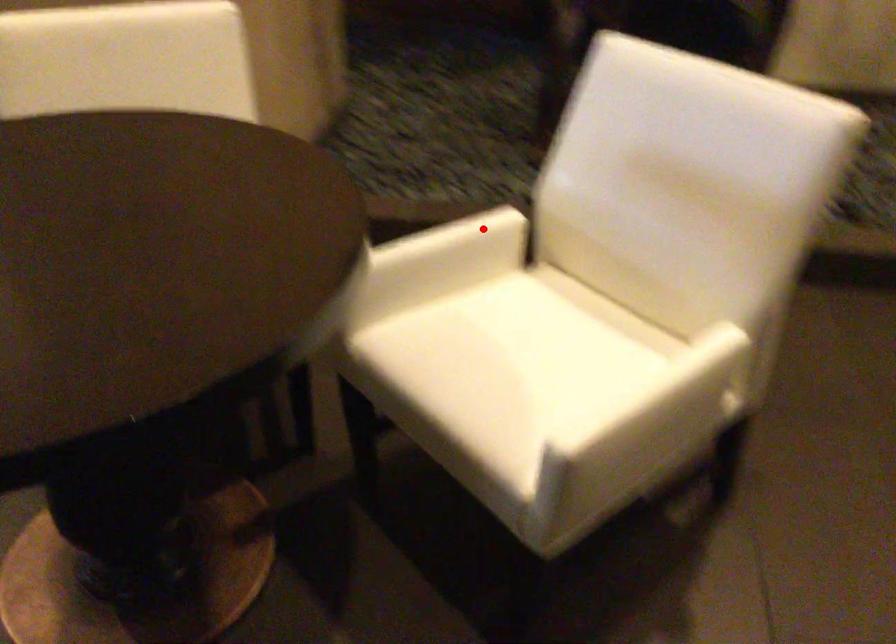
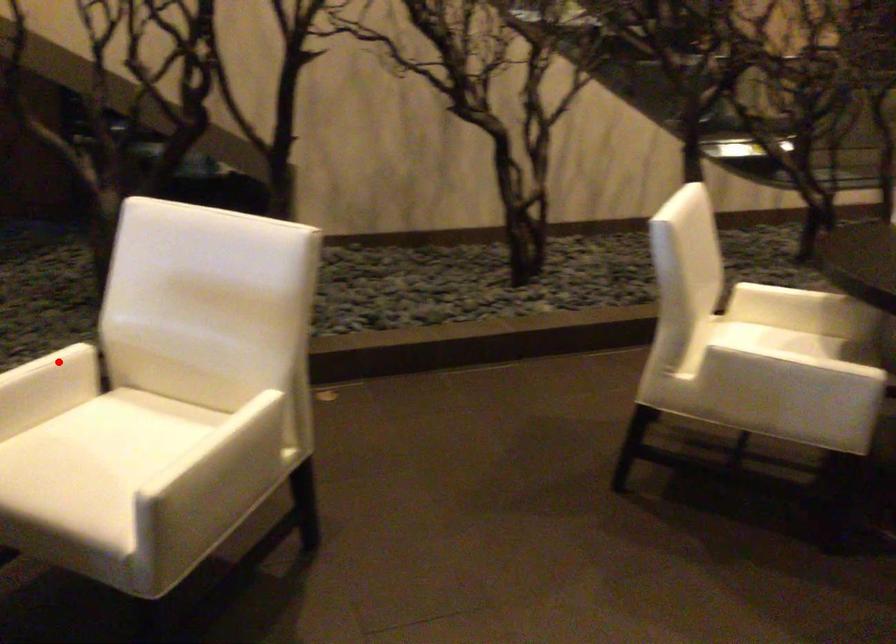
I am providing you with two images of the same scene from different viewpoints. A red point is marked on the first image and another point is marked on the second image. Are the points marked in image1 and image2 representing the same 3D position?

Yes